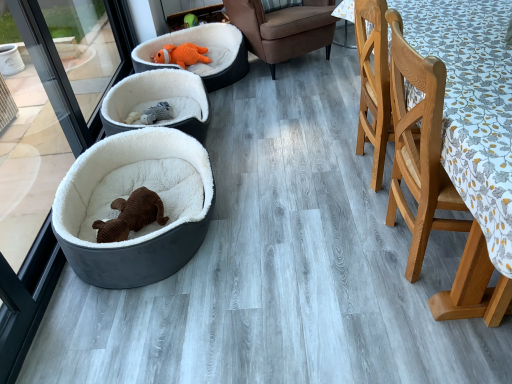
Question: In terms of height, does velvet brown dog bed at left, which is counted as the first dog bed, starting from the front, look taller or shorter compared to white plush dog bed at center, the 2th dog bed when ordered from back to front?

Choices:
 (A) tall
 (B) short

Answer: (A)

Question: Looking at the image, does velvet brown dog bed at left, acting as the 3th dog bed starting from the back, seem bigger or smaller compared to white plush dog bed at center, the 2th dog bed when ordered from back to front?

Choices:
 (A) small
 (B) big

Answer: (B)

Question: Considering the real-world distances, which object is closest to the orange plush toy at upper center?

Choices:
 (A) white plush dog bed at center, the 2th dog bed when ordered from back to front
 (B) brown fabric armchair at center, which is counted as the second chair, starting from the bottom
 (C) light brown wooden chair at right, the 1th chair when ordered from bottom to top
 (D) orange plush dog bed at upper center, arranged as the 1th dog bed when viewed from the back
 (E) velvet brown dog bed at left, which is counted as the first dog bed, starting from the front

Answer: (D)

Question: Which of these objects is positioned farthest from the orange plush dog bed at upper center, which appears as the 3th dog bed when viewed from the front?

Choices:
 (A) orange plush toy at upper center
 (B) brown fabric armchair at center, acting as the 1th chair starting from the top
 (C) white plush dog bed at center, the 2th dog bed viewed from the front
 (D) velvet brown dog bed at left, acting as the 3th dog bed starting from the back
 (E) light brown wooden chair at right, the 2th chair in the top-to-bottom sequence

Answer: (E)